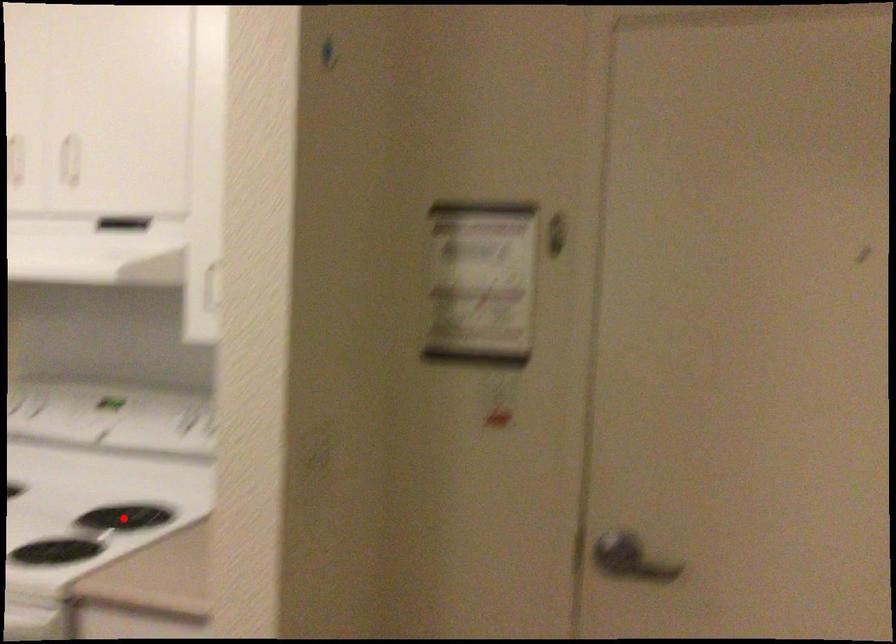
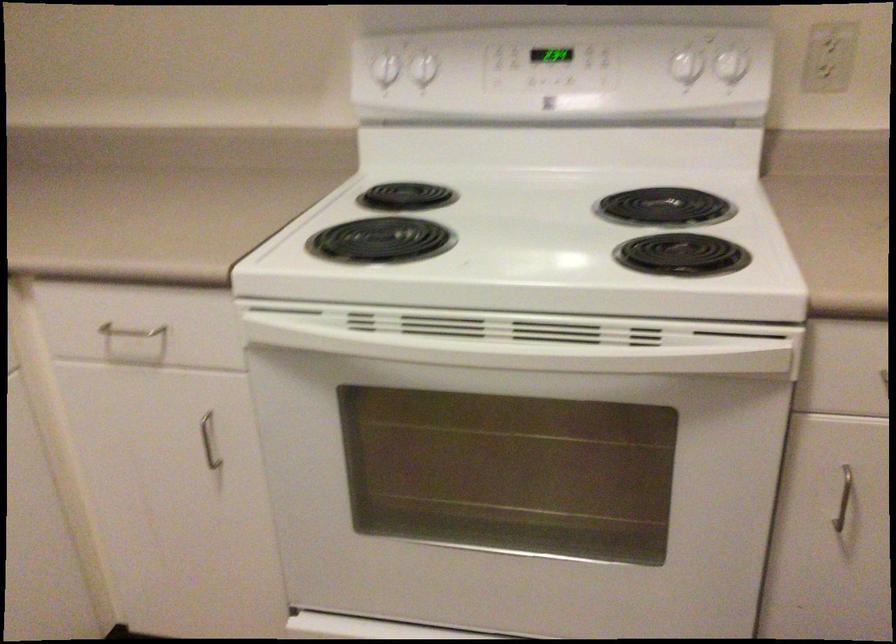
Question: I am providing you with two images of the same scene from different viewpoints. In image1, a red point is highlighted. Considering the same 3D point in image2, which of the following is correct?

Choices:
 (A) It is closer
 (B) It is farther

Answer: (A)